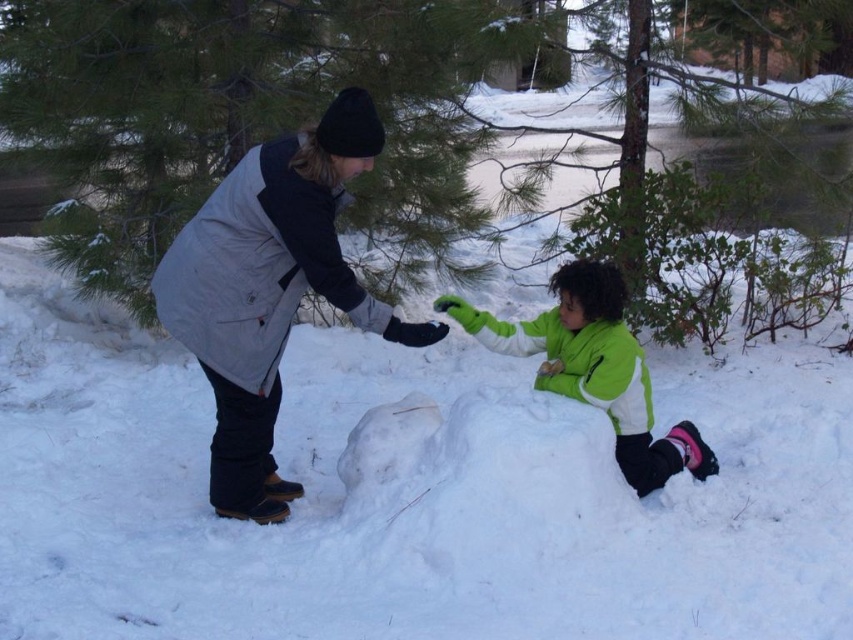
You are a delivery robot with a width of 0.8 meters. You need to deliver a package between the gray fleece jacket at center and the green fleece jacket at lower center. Is there enough space for you to pass through?

The distance between the gray fleece jacket at center and the green fleece jacket at lower center is 1.10 meters. Since the robot is 0.8 meters wide, there is sufficient space for the robot to pass through.

In the winter scene, there are two people wearing jackets. The adult is wearing a gray fleece jacket at center, and the child is wearing a green fleece jacket at lower center. From the perspective of someone standing behind the adult, which jacket is positioned higher?

The gray fleece jacket at center is located above the green fleece jacket at lower center, so from behind the adult, the gray fleece jacket at center is higher.

Based on the scene description, which object is taller between the gray fleece jacket at center and the green fleece jacket at lower center?

The gray fleece jacket at center is taller than the green fleece jacket at lower center.